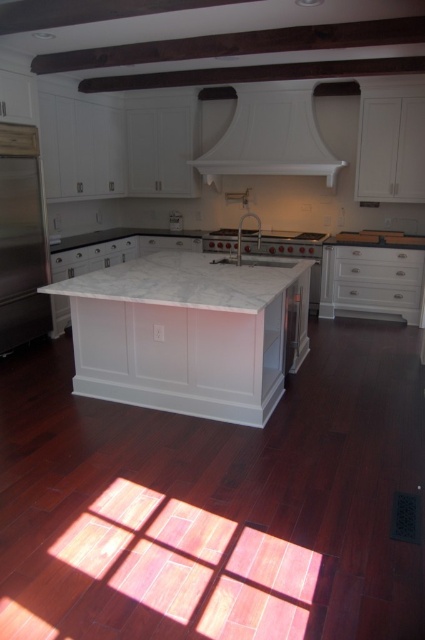
Is white marble countertop at center further to the viewer compared to white matte exhaust hood at upper center?

No, white marble countertop at center is in front of white matte exhaust hood at upper center.

Does white marble countertop at center have a greater height compared to white matte exhaust hood at upper center?

In fact, white marble countertop at center may be shorter than white matte exhaust hood at upper center.

What do you see at coordinates (189, 280) in the screenshot? The width and height of the screenshot is (425, 640). I see `white marble countertop at center` at bounding box center [189, 280].

This screenshot has width=425, height=640. In order to click on white marble countertop at center in this screenshot , I will do `click(189, 280)`.

Is white marble countertop at center smaller than stainless steel refrigerator at left?

No, white marble countertop at center is not smaller than stainless steel refrigerator at left.

In the scene shown: Which is more to the right, white marble countertop at center or stainless steel refrigerator at left?

From the viewer's perspective, white marble countertop at center appears more on the right side.

Is point (150, 285) closer to viewer compared to point (2, 228)?

Yes, point (150, 285) is in front of point (2, 228).

Find the location of a particular element. This screenshot has height=640, width=425. white marble countertop at center is located at coordinates (189, 280).

Is white matte exhaust hood at upper center taller than stainless steel refrigerator at left?

Incorrect, white matte exhaust hood at upper center's height is not larger of stainless steel refrigerator at left's.

Can you confirm if white matte exhaust hood at upper center is positioned to the right of stainless steel refrigerator at left?

Correct, you'll find white matte exhaust hood at upper center to the right of stainless steel refrigerator at left.

Between point (215, 154) and point (2, 218), which one is positioned in front?

Point (2, 218) is more forward.

This screenshot has width=425, height=640. Identify the location of white matte exhaust hood at upper center. (271, 136).